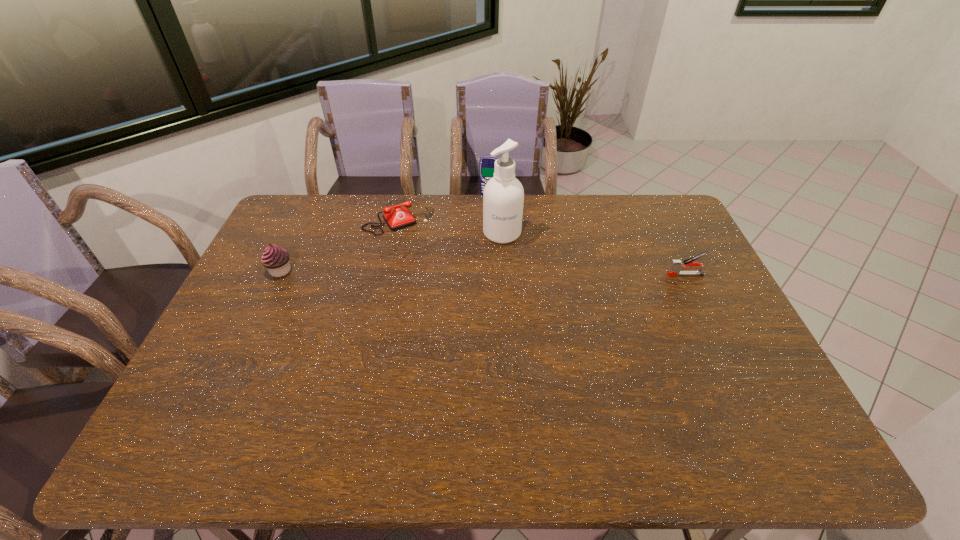
Where is `vacant spot on the desktop that is between the third shortest object and the second shortest object and is positioned on the dial of the telephone`? The height and width of the screenshot is (540, 960). vacant spot on the desktop that is between the third shortest object and the second shortest object and is positioned on the dial of the telephone is located at coordinates (435, 272).

You are a GUI agent. You are given a task and a screenshot of the screen. Output one action in this format:
    pyautogui.click(x=<x>, y=<y>)
    Task: Click on the vacant space on the desktop that is between the leftmost object and the fourth tallest object and is positioned on the front label of the cleansing agent
    The image size is (960, 540).
    Given the screenshot: What is the action you would take?
    pyautogui.click(x=508, y=273)

Where is `vacant spot on the desktop that is between the leftmost object and the stapler and is positioned on the front-facing side of the farthest object`? The image size is (960, 540). vacant spot on the desktop that is between the leftmost object and the stapler and is positioned on the front-facing side of the farthest object is located at coordinates (470, 272).